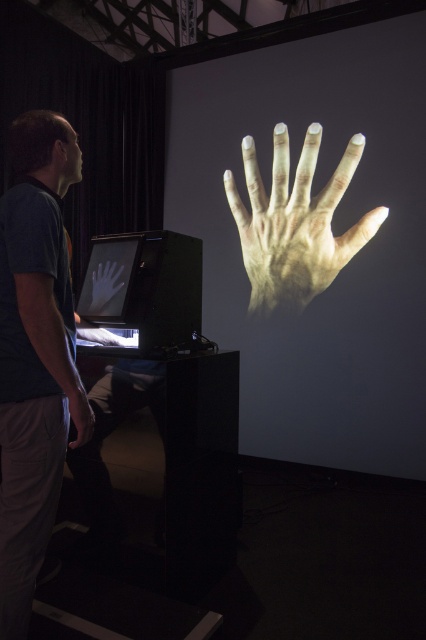
You are an art curator examining the projection screen. You notice two hands displayed there. Which hand, the matte white hand at center or the matte black hand at center, is positioned higher on the screen?

The matte white hand at center is located above the matte black hand at center, so the matte white hand at center is positioned higher on the screen.

You are an art curator examining the projected hands in the gallery. Which hand, the matte white hand at center or the matte black hand at center, is positioned to the right side of the other?

The matte white hand at center is positioned to the right of the matte black hand at center.

You are standing in the room and want to touch the two points on the projection screen. Which point, point (85, 424) or point (115, 280), is closer to you?

Point (85, 424) is closer to the camera than point (115, 280), so it is closer to you.